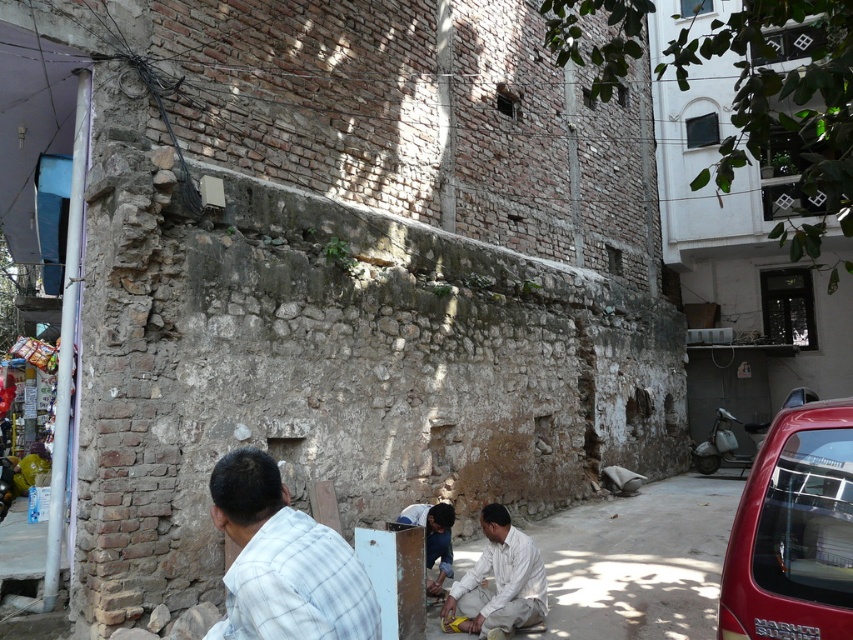
Between white checkered shirt at lower left and light brown fabric shirt at lower center, which one is positioned higher?

white checkered shirt at lower left

Does point (251, 467) come behind point (482, 557)?

No.

Is point (263, 502) behind point (514, 588)?

No, (263, 502) is closer to viewer.

Find the location of a particular element. This screenshot has height=640, width=853. white checkered shirt at lower left is located at coordinates (283, 561).

Can you confirm if shiny red car at lower right is smaller than light brown fabric shirt at lower center?

Indeed, shiny red car at lower right has a smaller size compared to light brown fabric shirt at lower center.

Is shiny red car at lower right below light brown fabric shirt at lower center?

Incorrect, shiny red car at lower right is not positioned below light brown fabric shirt at lower center.

Who is more forward, (836, 408) or (474, 564)?

Point (836, 408) is more forward.

You are a GUI agent. You are given a task and a screenshot of the screen. Output one action in this format:
    pyautogui.click(x=<x>, y=<y>)
    Task: Click on the shiny red car at lower right
    
    Given the screenshot: What is the action you would take?
    pyautogui.click(x=793, y=531)

Which of these two, shiny red car at lower right or white checkered shirt at lower left, stands shorter?

Standing shorter between the two is white checkered shirt at lower left.

Describe the element at coordinates (793, 531) in the screenshot. This screenshot has height=640, width=853. I see `shiny red car at lower right` at that location.

Identify the location of shiny red car at lower right. pos(793,531).